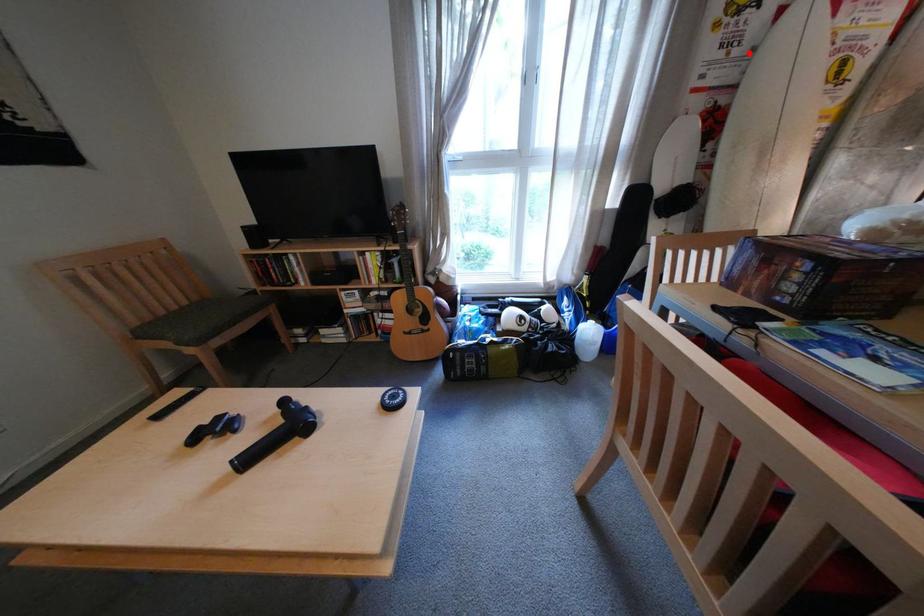
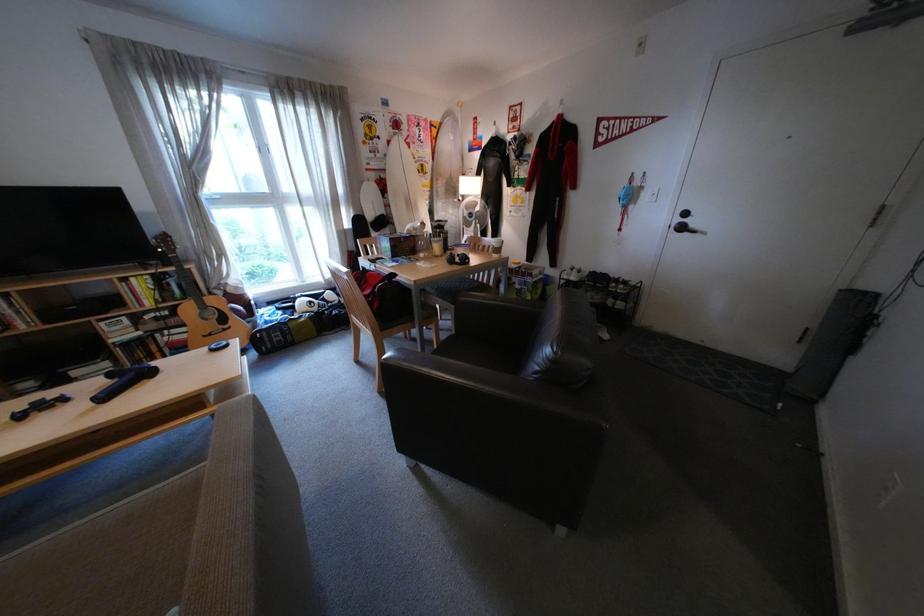
Question: I am providing you with two images of the same scene from different viewpoints. A red point is marked on the first image. At the location where the point appears in image 1, is it still visible in image 2?

Choices:
 (A) Yes
 (B) No

Answer: (A)